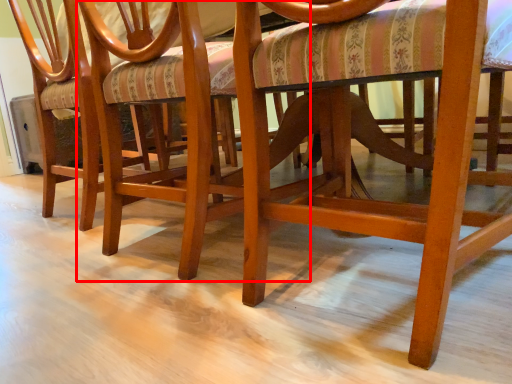
Question: From the image's perspective, where is chair (annotated by the red box) located relative to chair?

Choices:
 (A) below
 (B) above

Answer: (A)